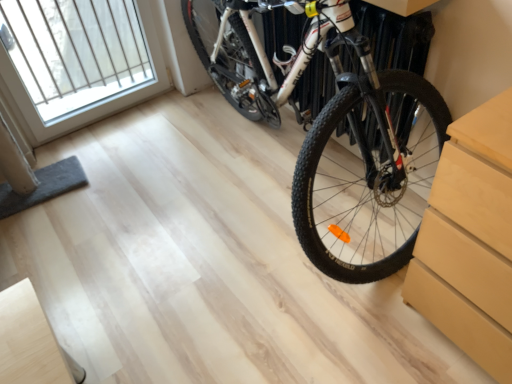
Locate an element on the screen. The image size is (512, 384). vacant area situated below white glass window at upper left (from a real-world perspective) is located at coordinates (114, 120).